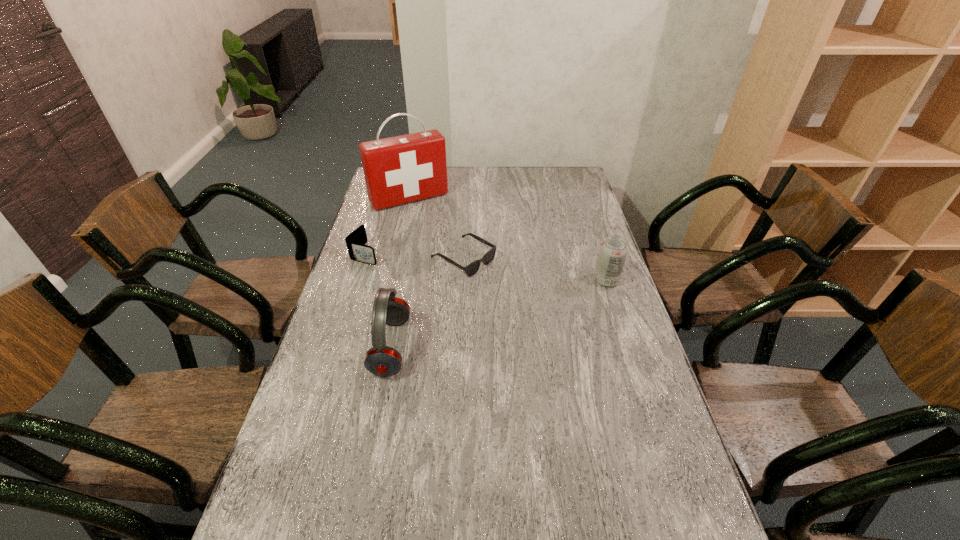
Locate an element on the screen. This screenshot has width=960, height=540. vacant area that lies between the rightmost object and the wallet is located at coordinates (486, 267).

In order to click on the third closest object to the soda can in this screenshot , I will do `click(398, 170)`.

Select which object is the fourth closest to the sunglasses. Please provide its 2D coordinates. Your answer should be formatted as a tuple, i.e. [(x, y)], where the tuple contains the x and y coordinates of a point satisfying the conditions above.

[(613, 251)]

Locate an element on the screen. free region that satisfies the following two spatial constraints: 1. on the front side of the first-aid kit; 2. on the left side of the shortest object is located at coordinates (396, 259).

The image size is (960, 540). In order to click on free spot that satisfies the following two spatial constraints: 1. on the front side of the second tallest object; 2. on the ear cups of the farthest object in this screenshot , I will do `click(375, 347)`.